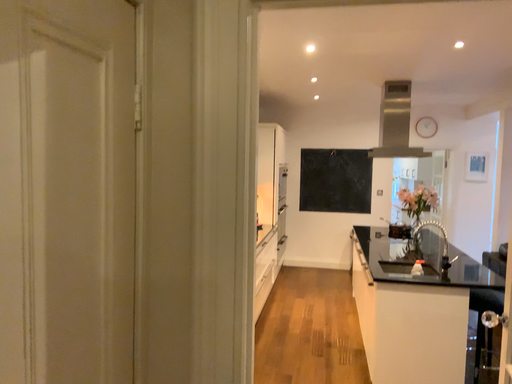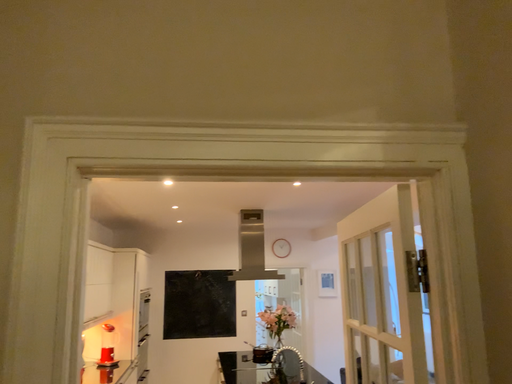
Question: Which way did the camera rotate in the video?

Choices:
 (A) rotated downward
 (B) rotated upward

Answer: (B)